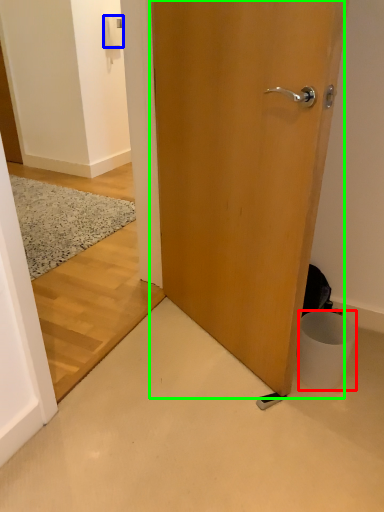
Question: Considering the real-world distances, which object is farthest from trash bin/can (highlighted by a red box)? light switch (highlighted by a blue box) or door (highlighted by a green box)?

Choices:
 (A) light switch
 (B) door

Answer: (A)